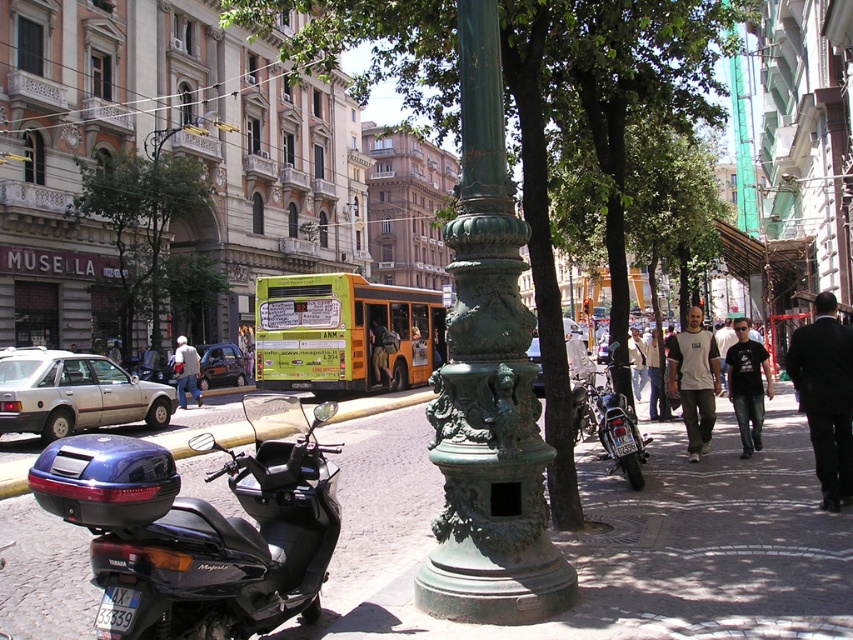
Question: Which is nearer to the green patinated metal pole at center?

Choices:
 (A) yellow matte bus at center
 (B) smooth concrete pavement at center
 (C) green patinated metal streetlamp at upper left
 (D) black glossy scooter at lower left

Answer: (D)

Question: Can you confirm if smooth concrete pavement at center is positioned above green textured pole at center?

Choices:
 (A) yes
 (B) no

Answer: (B)

Question: Based on their relative distances, which object is nearer to the green patinated metal pole at center?

Choices:
 (A) smooth concrete pavement at center
 (B) yellow matte bus at center
 (C) green patinated metal streetlamp at upper left
 (D) black glossy scooter at lower left

Answer: (D)

Question: Is smooth concrete pavement at center further to the viewer compared to green leafy tree at upper left?

Choices:
 (A) no
 (B) yes

Answer: (A)

Question: Is smooth concrete pavement at center further to camera compared to green patinated metal pole at center?

Choices:
 (A) no
 (B) yes

Answer: (A)

Question: Which of these objects is positioned closest to the green patinated metal pole at center?

Choices:
 (A) green textured pole at center
 (B) green leafy tree at upper left
 (C) black glossy scooter at lower left

Answer: (C)